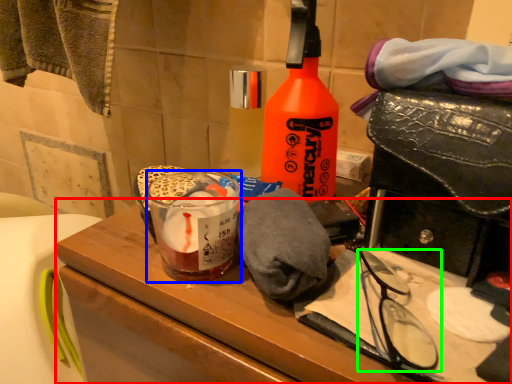
Question: Which object is the farthest from vanity (highlighted by a red box)? Choose among these: beverage (highlighted by a blue box) or glasses (highlighted by a green box).

Choices:
 (A) beverage
 (B) glasses

Answer: (B)